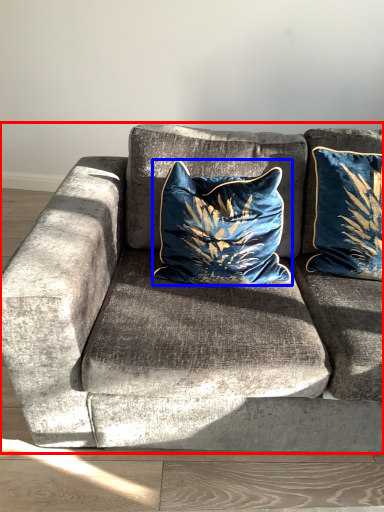
Question: Which of the following is the farthest to the observer, studio couch (highlighted by a red box) or pillow (highlighted by a blue box)?

Choices:
 (A) studio couch
 (B) pillow

Answer: (B)